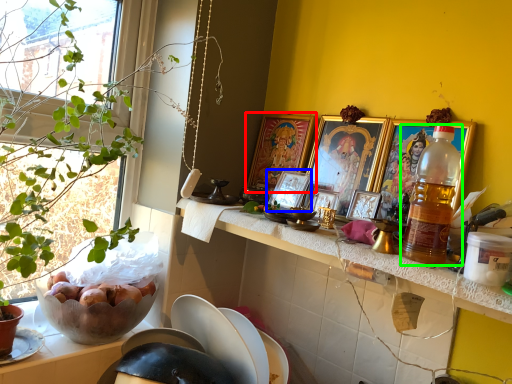
Question: Considering the real-world distances, which object is farthest from picture frame (highlighted by a red box)? picture frame (highlighted by a blue box) or bottle (highlighted by a green box)?

Choices:
 (A) picture frame
 (B) bottle

Answer: (B)